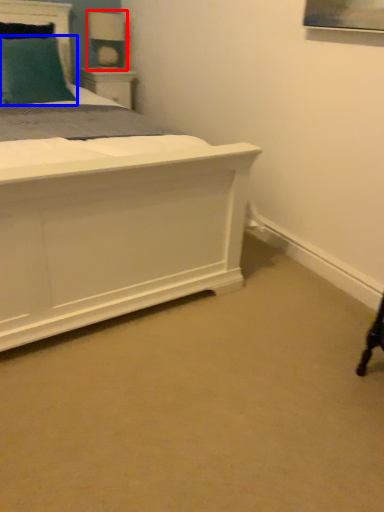
Question: Which object is closer to the camera taking this photo, table lamp (highlighted by a red box) or pillow (highlighted by a blue box)?

Choices:
 (A) table lamp
 (B) pillow

Answer: (B)